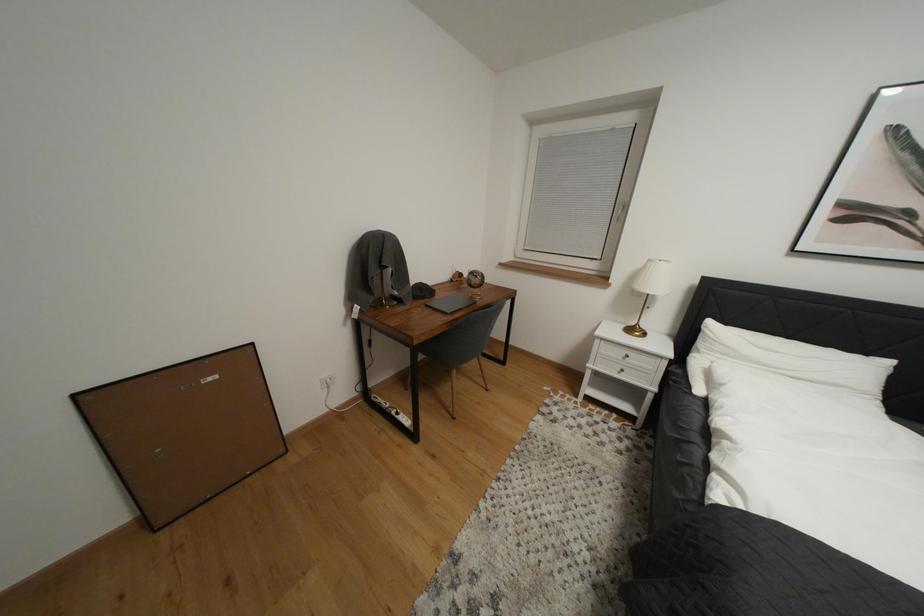
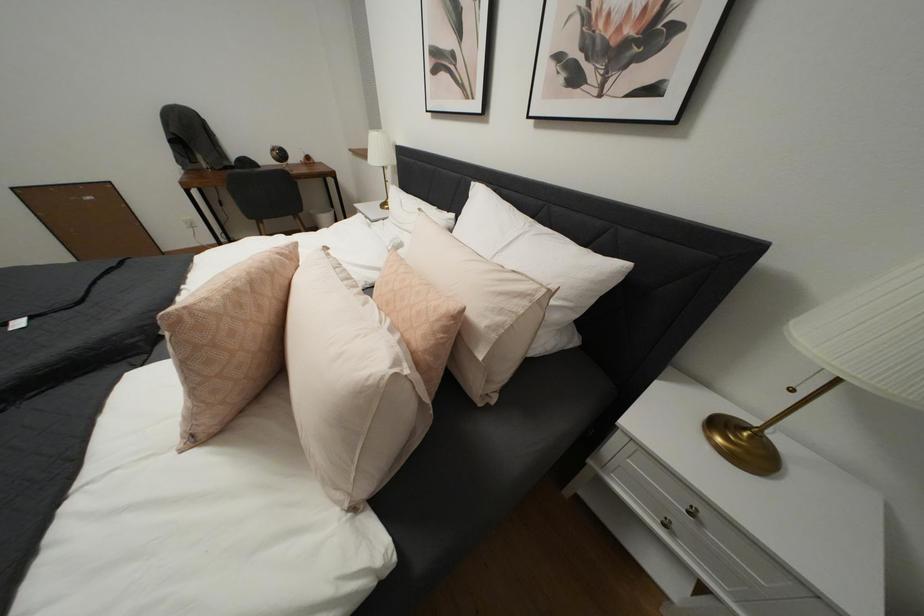
Question: In a continuous first-person perspective shot, in which direction is the camera moving?

Choices:
 (A) Left
 (B) Right
 (C) Forward
 (D) Backward

Answer: (B)